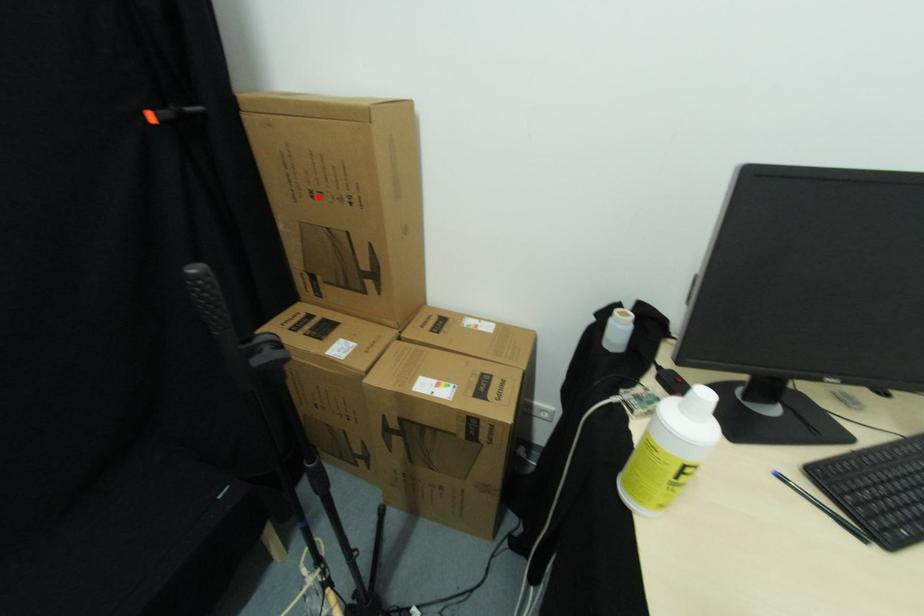
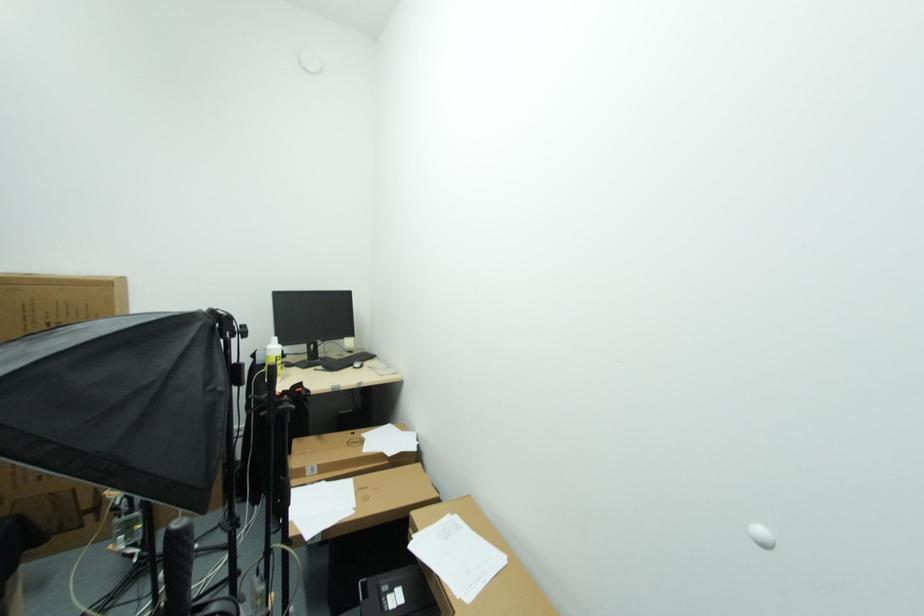
The point at the highlighted location is marked in the first image. Where is the corresponding point in the second image?

(53, 328)